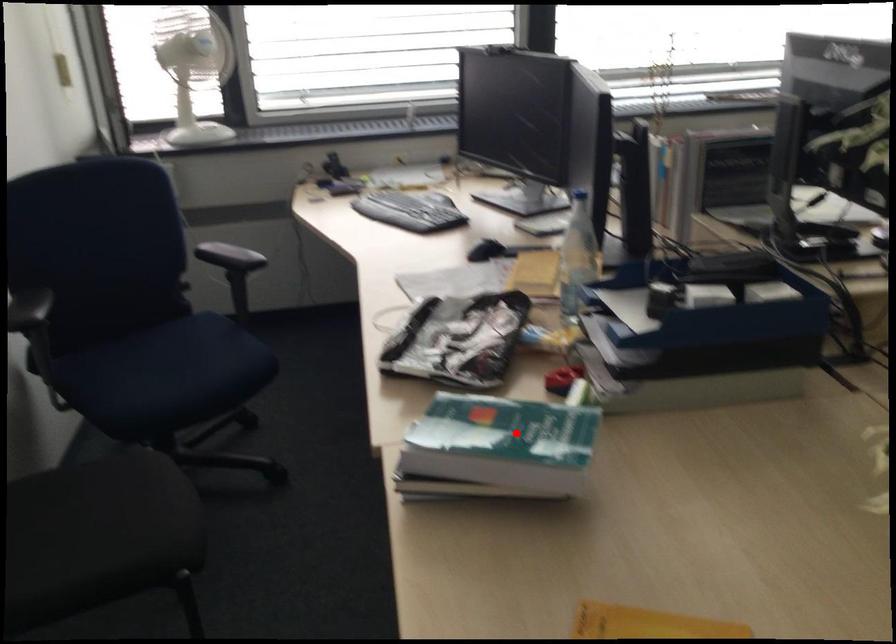
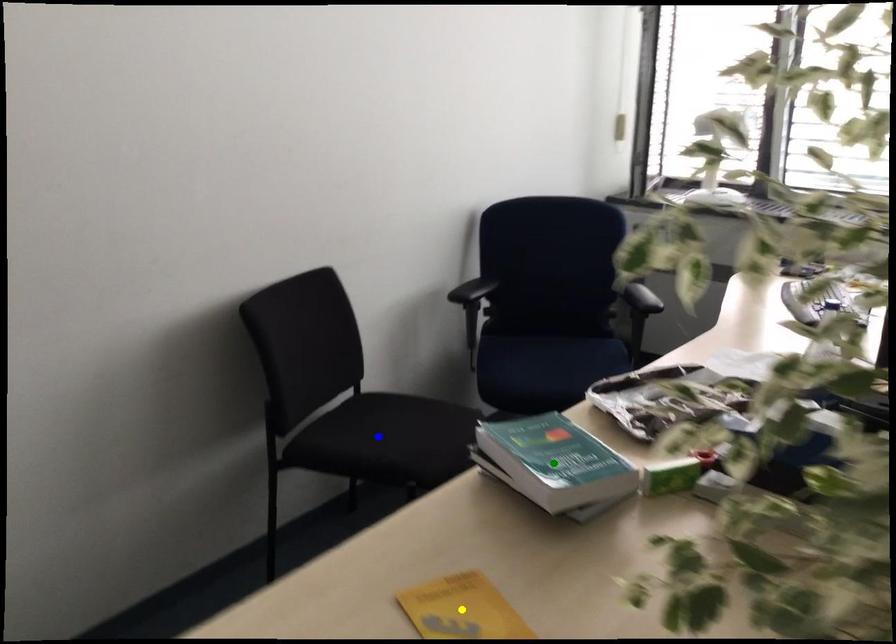
Question: I am providing you with two images of the same scene from different viewpoints. A red point is marked on the first image. You are given multiple points on the second image. Can you choose the point in image 2 that corresponds to the point in image 1?

Choices:
 (A) yellow point
 (B) green point
 (C) blue point

Answer: (B)